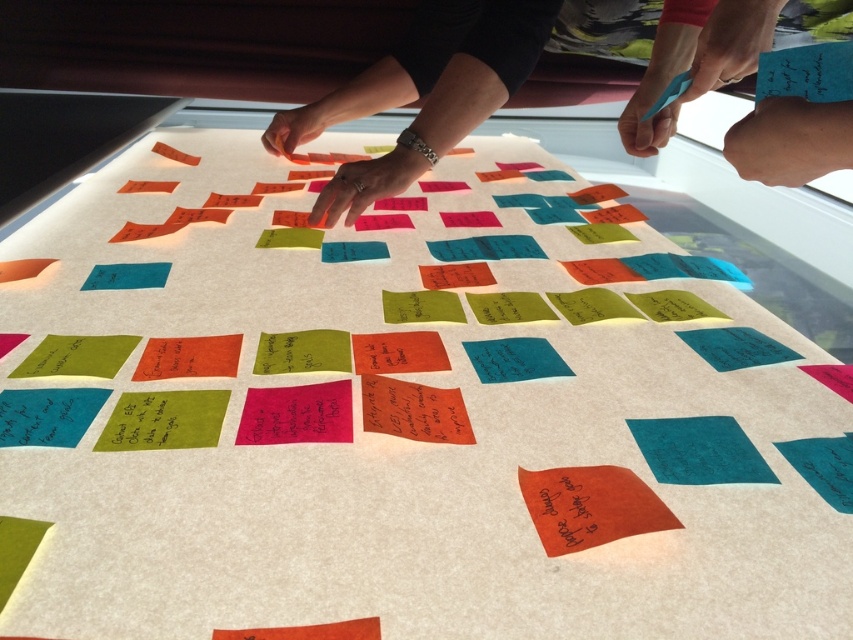
Question: Which object is the farthest from the orange sticky notes at upper left?

Choices:
 (A) blue paper at upper right
 (B) smooth skin hands at upper center

Answer: (A)

Question: Which point appears closest to the camera in this image?

Choices:
 (A) (819, 108)
 (B) (135, 106)

Answer: (A)

Question: Which point is closer to the camera?

Choices:
 (A) (440, 26)
 (B) (83, 141)

Answer: (A)

Question: Where is blue paper at upper right located in relation to orange sticky notes at upper left in the image?

Choices:
 (A) below
 (B) above

Answer: (A)

Question: From the image, what is the correct spatial relationship of smooth skin hands at upper center in relation to blue paper at upper right?

Choices:
 (A) below
 (B) above

Answer: (B)

Question: Is the position of smooth skin hands at upper center more distant than that of blue paper at upper right?

Choices:
 (A) yes
 (B) no

Answer: (A)